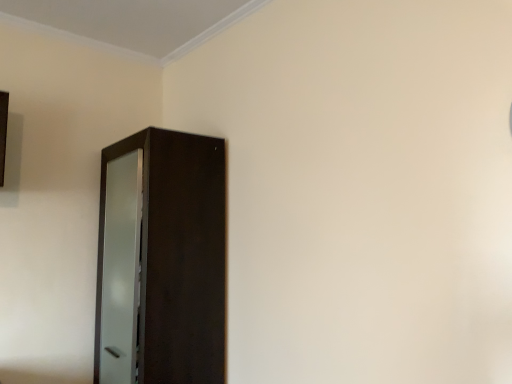
Question: Should I look upward or downward to see dark wood cabinet at center?

Choices:
 (A) up
 (B) down

Answer: (B)